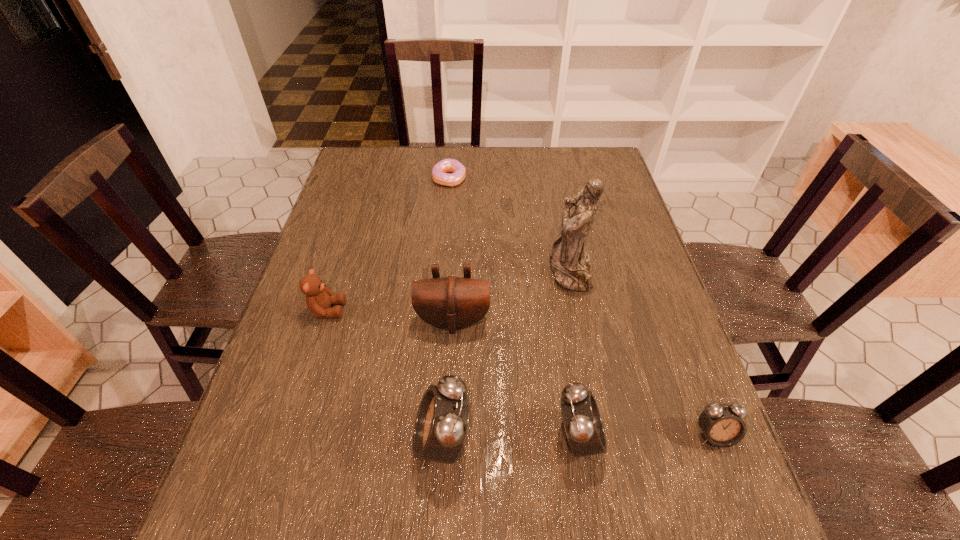
In order to click on unoccupied area between the second alarm clock from right to left and the second shortest object in this screenshot , I will do `click(646, 436)`.

The height and width of the screenshot is (540, 960). I want to click on free space between the second alarm clock from left to right and the teddy bear, so click(453, 374).

This screenshot has height=540, width=960. Identify the location of free spot between the pouch and the second shortest alarm clock. (516, 379).

Where is `blank region between the figurine and the farthest object`? This screenshot has height=540, width=960. blank region between the figurine and the farthest object is located at coordinates (510, 225).

The height and width of the screenshot is (540, 960). I want to click on unoccupied area between the shortest object and the teddy bear, so click(x=388, y=245).

Locate an element on the screen. The width and height of the screenshot is (960, 540). object that ranks as the second closest to the pouch is located at coordinates (318, 298).

Where is `object that stands as the sixth closest to the leftmost alarm clock`? Image resolution: width=960 pixels, height=540 pixels. object that stands as the sixth closest to the leftmost alarm clock is located at coordinates (440, 173).

Identify which alarm clock is located as the second nearest to the leftmost alarm clock. Please provide its 2D coordinates. Your answer should be formatted as a tuple, i.e. [(x, y)], where the tuple contains the x and y coordinates of a point satisfying the conditions above.

[(722, 425)]

Select which alarm clock is the closest to the rightmost object. Please provide its 2D coordinates. Your answer should be formatted as a tuple, i.e. [(x, y)], where the tuple contains the x and y coordinates of a point satisfying the conditions above.

[(582, 421)]

Identify the location of free spot that satisfies the following two spatial constraints: 1. with the flap open on the pouch; 2. on the face of the leftmost alarm clock. The height and width of the screenshot is (540, 960). (446, 441).